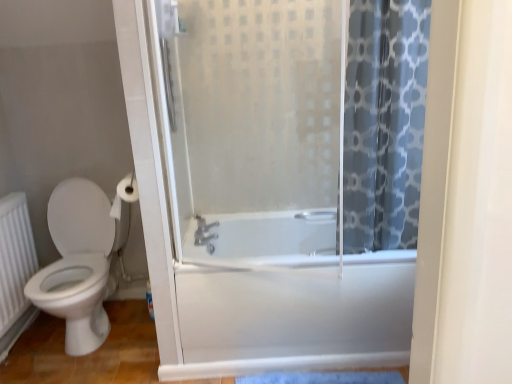
Question: From a real-world perspective, is white textured radiator at lower left positioned above or below white matte toilet paper at upper left?

Choices:
 (A) below
 (B) above

Answer: (A)

Question: Is white textured radiator at lower left situated inside white matte toilet paper at upper left or outside?

Choices:
 (A) inside
 (B) outside

Answer: (B)

Question: Which is farther from the satin nickel faucet at center?

Choices:
 (A) white glossy bathtub at center
 (B) blue printed fabric at right
 (C) white glossy toilet at left
 (D) white matte toilet paper at upper left
 (E) white textured radiator at lower left

Answer: (B)

Question: Which object is positioned closest to the white matte toilet paper at upper left?

Choices:
 (A) frosted glass shower door at center
 (B) white textured radiator at lower left
 (C) white glossy toilet at left
 (D) satin nickel faucet at center
 (E) blue printed fabric at right

Answer: (C)